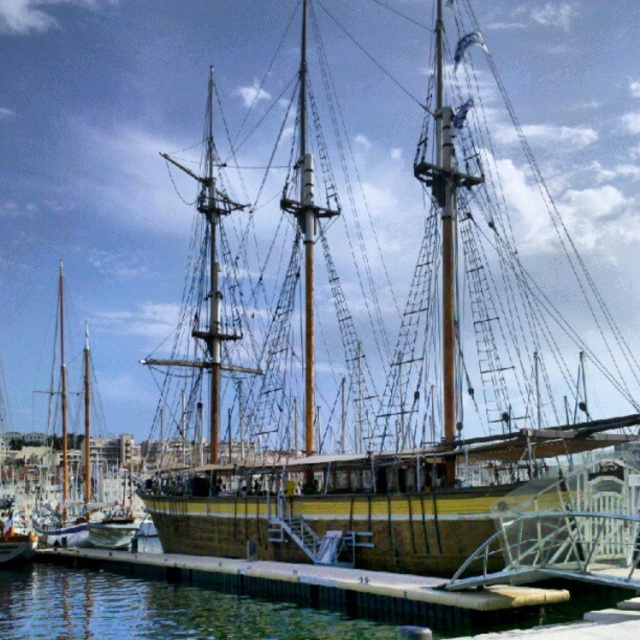
Question: Which point is closer to the camera taking this photo?

Choices:
 (A) (211, 548)
 (B) (58, 296)

Answer: (A)

Question: Considering the relative positions of wooden ship at center and wooden mast at center in the image provided, where is wooden ship at center located with respect to wooden mast at center?

Choices:
 (A) right
 (B) left

Answer: (A)

Question: Can you confirm if wooden ship at center is smaller than wooden mast at center?

Choices:
 (A) yes
 (B) no

Answer: (B)

Question: Can you confirm if wooden ship at center is smaller than wooden mast at center?

Choices:
 (A) yes
 (B) no

Answer: (B)